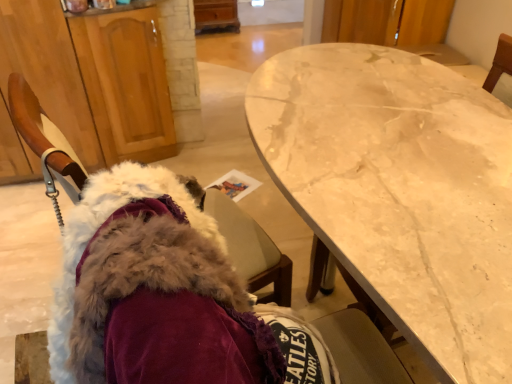
Question: Is there a large distance between wooden cabinet at left and white marble table at center?

Choices:
 (A) yes
 (B) no

Answer: (A)

Question: Is wooden cabinet at left turned away from white marble table at center?

Choices:
 (A) no
 (B) yes

Answer: (A)

Question: Can you confirm if wooden cabinet at left is shorter than white marble table at center?

Choices:
 (A) yes
 (B) no

Answer: (A)

Question: Are wooden cabinet at left and white marble table at center making contact?

Choices:
 (A) yes
 (B) no

Answer: (B)

Question: Is wooden cabinet at left to the right of white marble table at center from the viewer's perspective?

Choices:
 (A) yes
 (B) no

Answer: (B)

Question: Visually, is fuzzy fabric chair at left positioned to the left or to the right of wooden cabinet at left?

Choices:
 (A) left
 (B) right

Answer: (B)

Question: From a real-world perspective, is fuzzy fabric chair at left positioned above or below wooden cabinet at left?

Choices:
 (A) above
 (B) below

Answer: (A)

Question: Is fuzzy fabric chair at left in front of or behind wooden cabinet at left in the image?

Choices:
 (A) front
 (B) behind

Answer: (A)

Question: Choose the correct answer: Is fuzzy fabric chair at left inside wooden cabinet at left or outside it?

Choices:
 (A) inside
 (B) outside

Answer: (B)

Question: From a real-world perspective, is wooden cabinet at left above or below fuzzy fabric chair at left?

Choices:
 (A) above
 (B) below

Answer: (B)

Question: Considering the relative positions of wooden cabinet at left and fuzzy fabric chair at left in the image provided, is wooden cabinet at left to the left or to the right of fuzzy fabric chair at left?

Choices:
 (A) right
 (B) left

Answer: (B)

Question: Considering their positions, is wooden cabinet at left located in front of or behind fuzzy fabric chair at left?

Choices:
 (A) front
 (B) behind

Answer: (B)

Question: Considering the positions of wooden cabinet at left and fuzzy fabric chair at left in the image, is wooden cabinet at left taller or shorter than fuzzy fabric chair at left?

Choices:
 (A) short
 (B) tall

Answer: (B)

Question: Is point (329, 66) positioned closer to the camera than point (134, 124)?

Choices:
 (A) closer
 (B) farther

Answer: (A)

Question: Looking at their shapes, would you say white marble table at center is wider or thinner than wooden cabinet at left?

Choices:
 (A) wide
 (B) thin

Answer: (A)